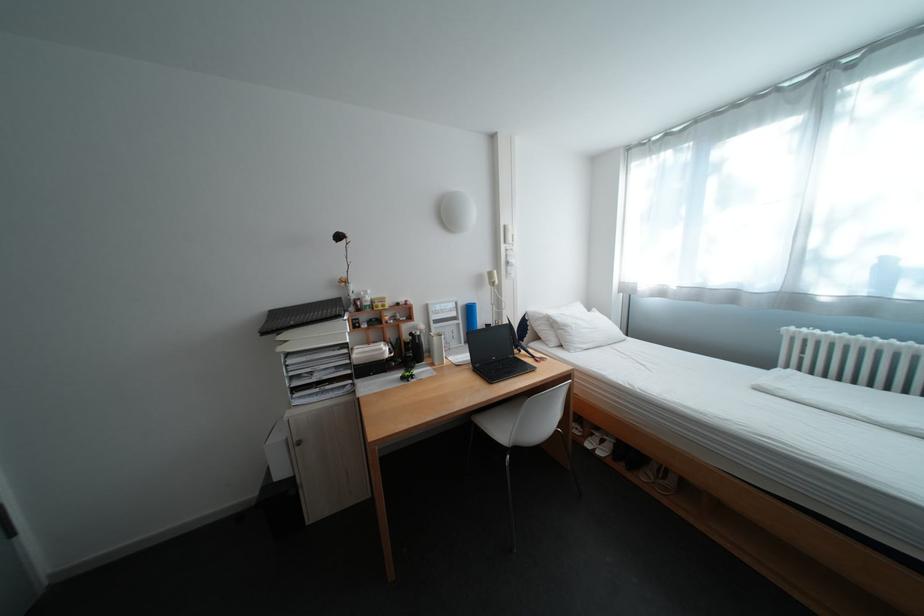
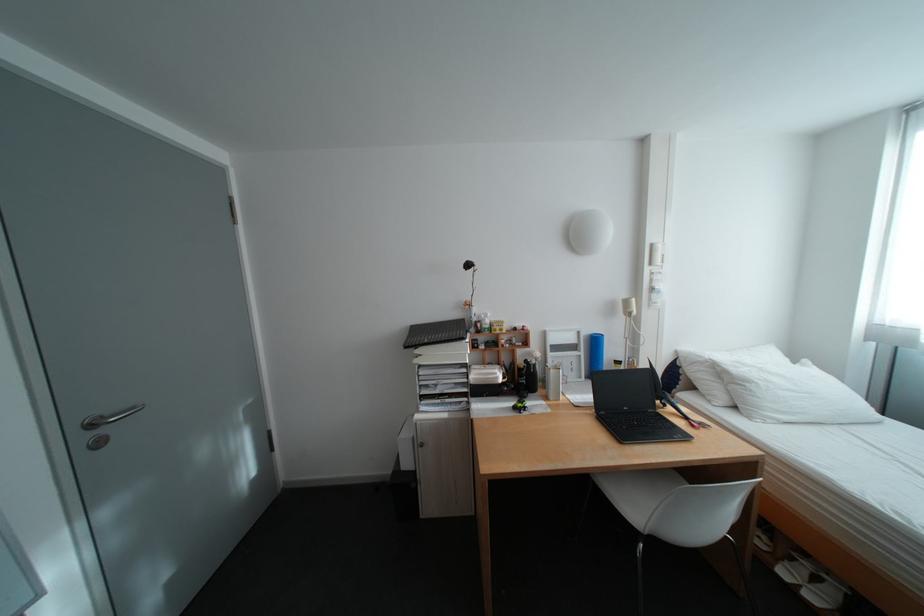
Find the pixel in the second image that matches (x=360, y=344) in the first image.

(480, 363)